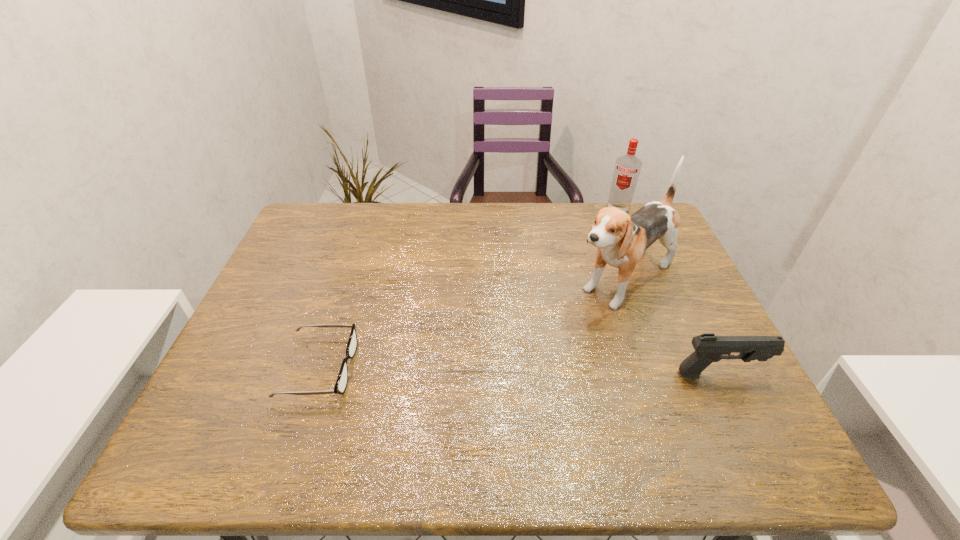
I want to click on object that is at the near left corner, so click(342, 380).

Where is `object situated at the far right corner`? Image resolution: width=960 pixels, height=540 pixels. object situated at the far right corner is located at coordinates (627, 168).

In the image, there is a desktop. Identify the location of free space at the far edge. This screenshot has height=540, width=960. (457, 202).

In the image, there is a desktop. Identify the location of vacant space at the near edge. (423, 406).

This screenshot has width=960, height=540. I want to click on vacant region at the left edge of the desktop, so click(274, 301).

Image resolution: width=960 pixels, height=540 pixels. In the image, there is a desktop. Identify the location of free space at the far left corner. (309, 234).

This screenshot has width=960, height=540. What are the coordinates of `free location at the near right corner` in the screenshot? It's located at (701, 400).

Find the location of a particular element. This screenshot has width=960, height=540. free space between the farthest object and the second shortest object is located at coordinates (668, 293).

Identify the location of blank region between the second tallest object and the pistol. (668, 293).

I want to click on empty location between the pistol and the leftmost object, so click(519, 371).